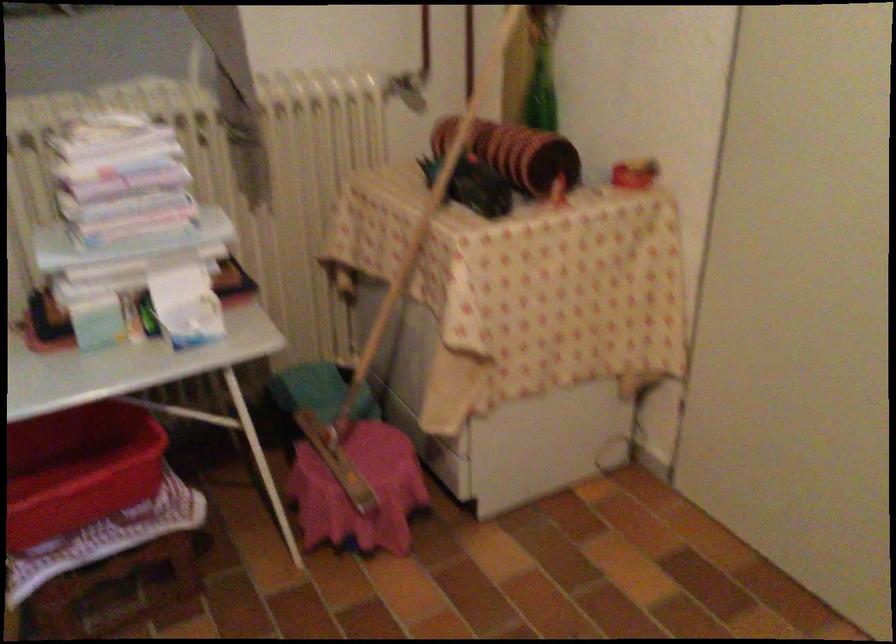
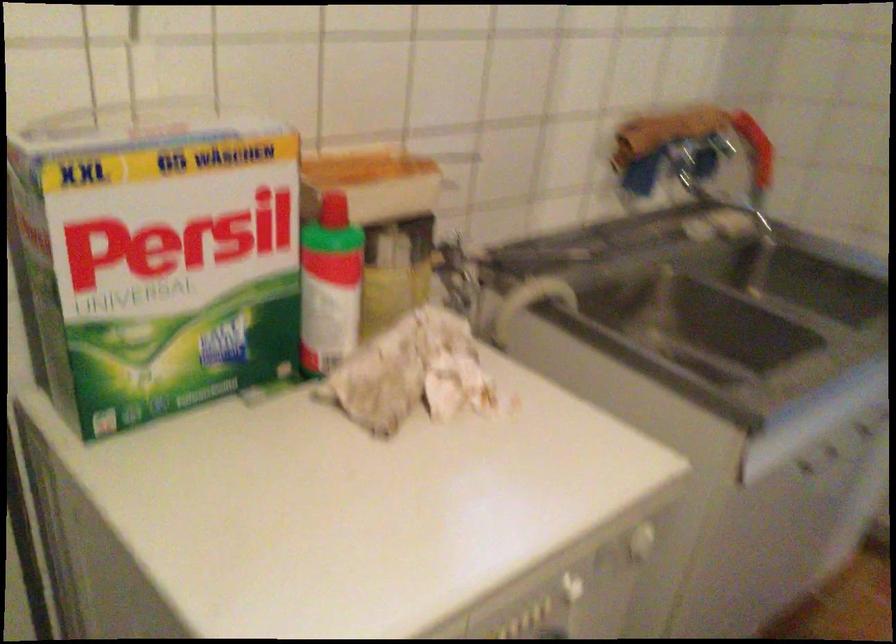
Based on the continuous images, in which direction is the camera rotating?

The camera rotated toward right-down.